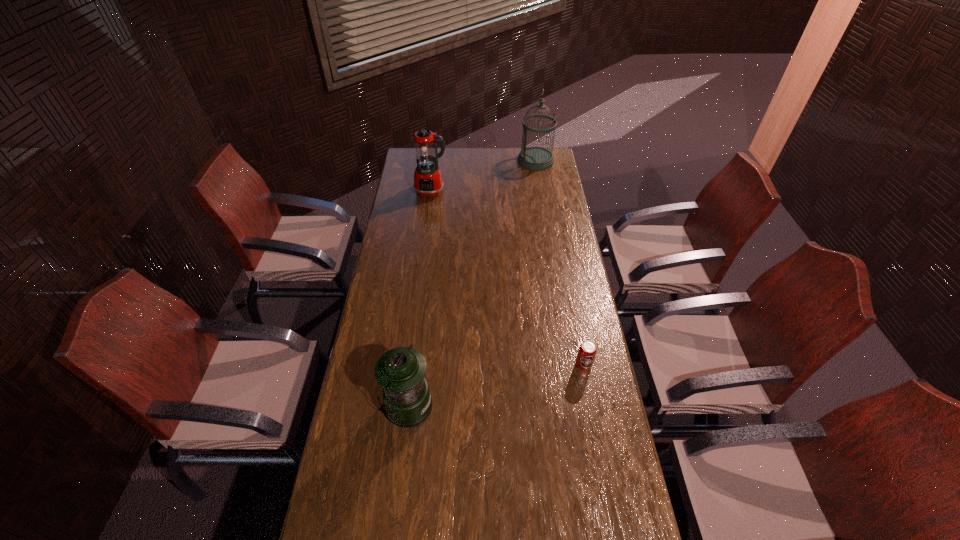
The width and height of the screenshot is (960, 540). In the image, there is a desktop. In order to click on vacant space at the far edge in this screenshot , I will do `click(474, 162)`.

This screenshot has height=540, width=960. I want to click on vacant space at the left edge, so (381, 315).

Locate an element on the screen. This screenshot has width=960, height=540. free space at the right edge of the desktop is located at coordinates (540, 258).

Where is `vacant point located between the food processor and the third farthest object`? The image size is (960, 540). vacant point located between the food processor and the third farthest object is located at coordinates (507, 278).

In order to click on free space between the farthest object and the soda in this screenshot , I will do `click(560, 262)`.

Image resolution: width=960 pixels, height=540 pixels. In order to click on free spot between the farthest object and the second shortest object in this screenshot , I will do `click(471, 283)`.

You are a GUI agent. You are given a task and a screenshot of the screen. Output one action in this format:
    pyautogui.click(x=<x>, y=<y>)
    Task: Click on the free spot between the nearest object and the food processor
    The height and width of the screenshot is (540, 960).
    Given the screenshot: What is the action you would take?
    pyautogui.click(x=420, y=299)

In order to click on vacant space that's between the third farthest object and the second tallest object in this screenshot , I will do 507,278.

I want to click on vacant area that lies between the farthest object and the soda, so click(560, 262).

The height and width of the screenshot is (540, 960). I want to click on vacant point located between the third shortest object and the third farthest object, so click(507, 278).